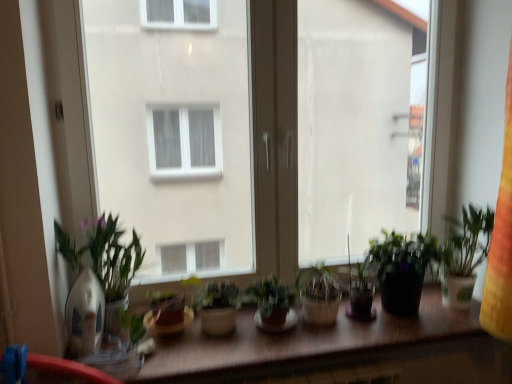
This screenshot has width=512, height=384. Identify the location of vacant space in green matte plant at center, which is the 2th houseplant from right to left (from a real-world perspective). (273, 328).